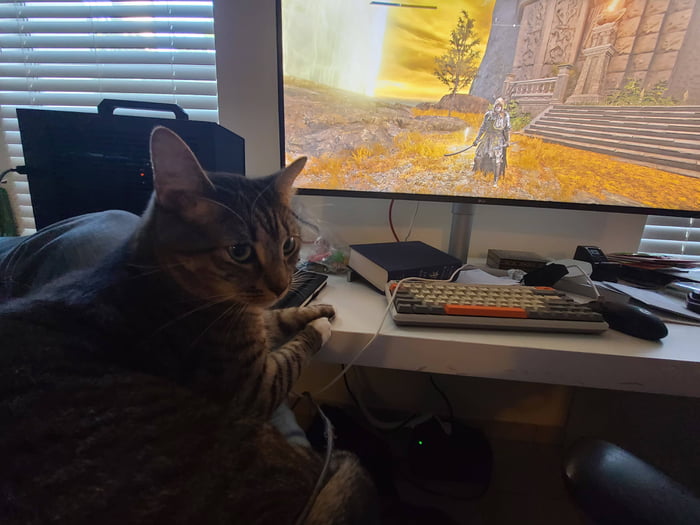
Locate an element on the screen. white blinds in the background on the right is located at coordinates (659, 222), (662, 232), (654, 249).